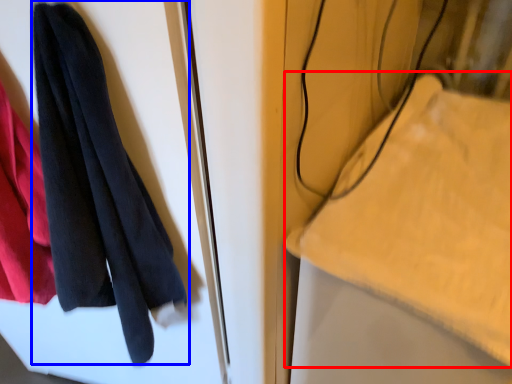
Question: Which object appears farthest to the camera in this image, cloth (highlighted by a red box) or towel (highlighted by a blue box)?

Choices:
 (A) cloth
 (B) towel

Answer: (A)